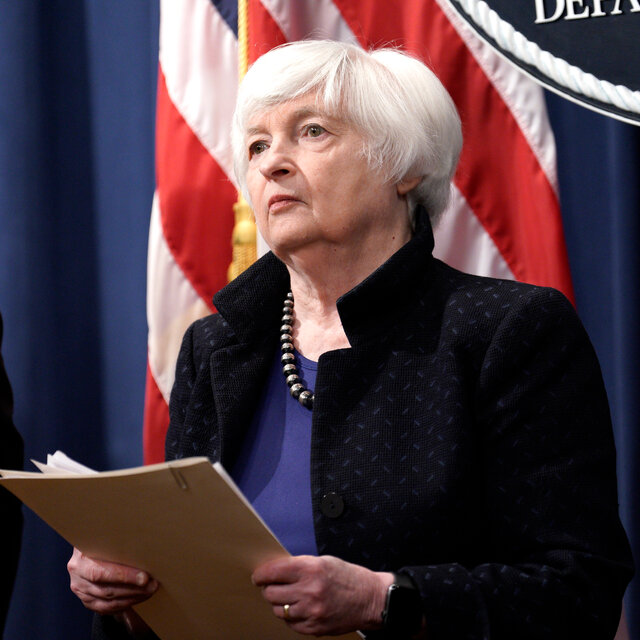
Locate an element on the screen. The width and height of the screenshot is (640, 640). folder is located at coordinates (186, 506).